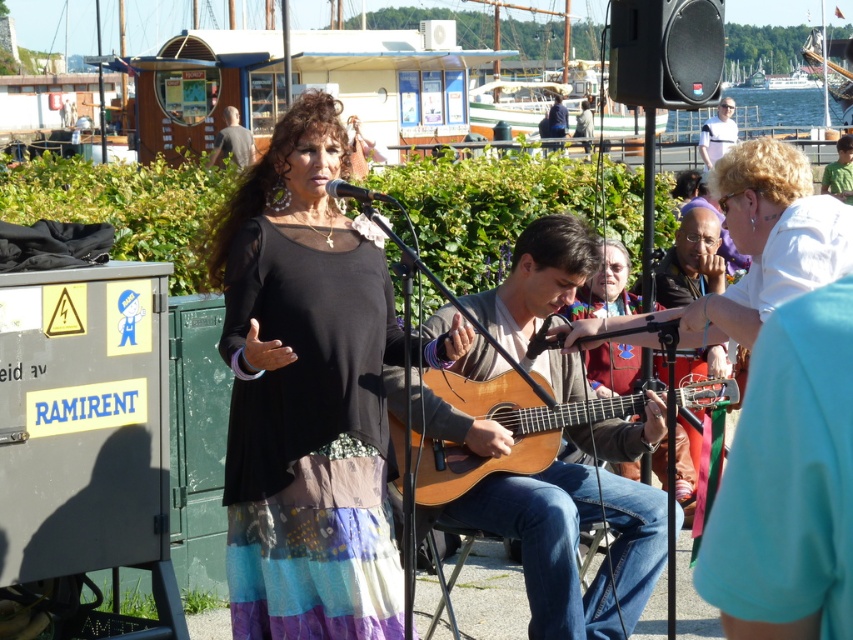
You are a photographer standing at the front of the stage. You see the white cotton shirt at upper right and the gray fabric shirt at upper center. Which shirt is nearer to you?

The white cotton shirt at upper right is closer to the viewer than the gray fabric shirt at upper center, so the white cotton shirt at upper right is nearer to you.

You are a photographer standing at the center of the scene. You want to take a photo that includes both the woman singing and the man playing the guitar. Which point, point (729, 113) or point (230, 147), is closer to your position?

Point (230, 147) is closer to your position because it is nearer to the camera than point (729, 113).